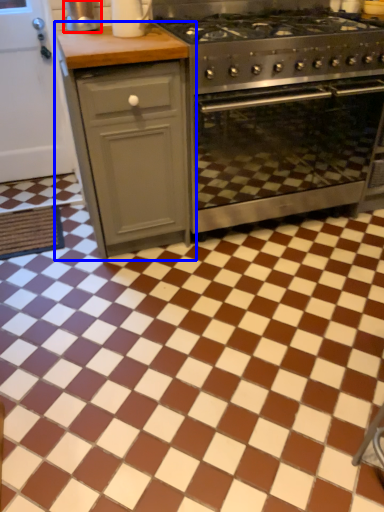
Question: Which of the following is the closest to the observer, appliance (highlighted by a red box) or cabinetry (highlighted by a blue box)?

Choices:
 (A) appliance
 (B) cabinetry

Answer: (B)